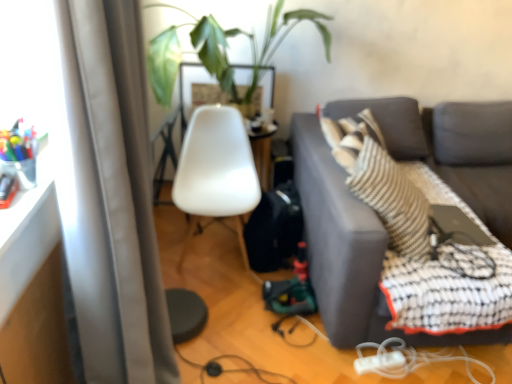
You are a GUI agent. You are given a task and a screenshot of the screen. Output one action in this format:
    pyautogui.click(x=<x>, y=<y>)
    Task: Click on the vacant space underneath white matte chair at center (from a real-world perspective)
    This screenshot has width=512, height=384.
    Given the screenshot: What is the action you would take?
    pyautogui.click(x=216, y=255)